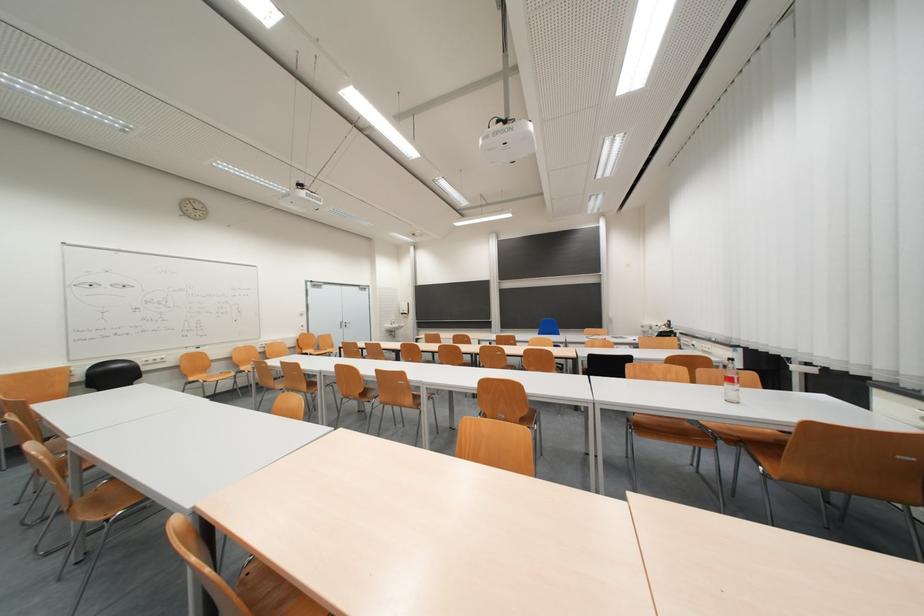
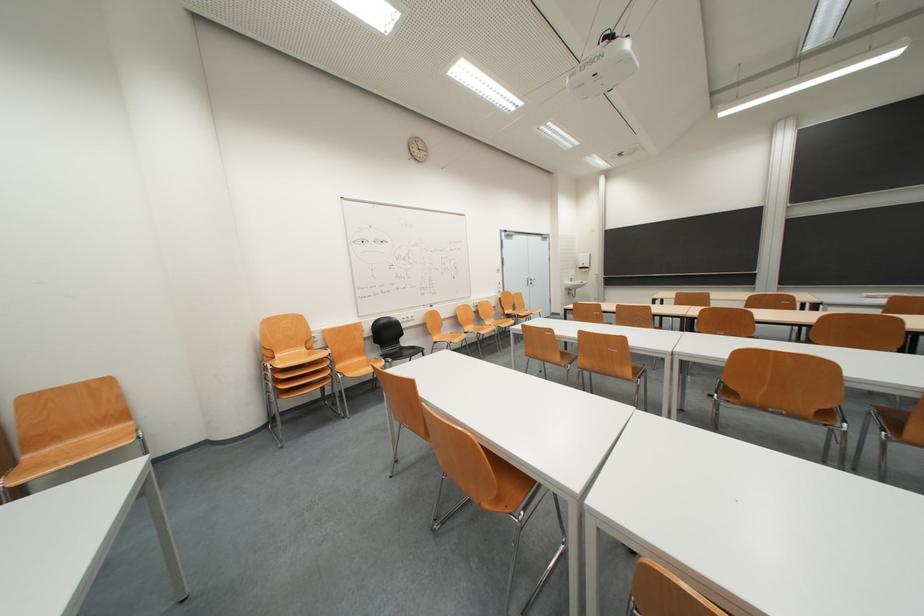
Question: What movement of the cameraman would produce the second image?

Choices:
 (A) Left
 (B) Right
 (C) Forward
 (D) Backward

Answer: (A)